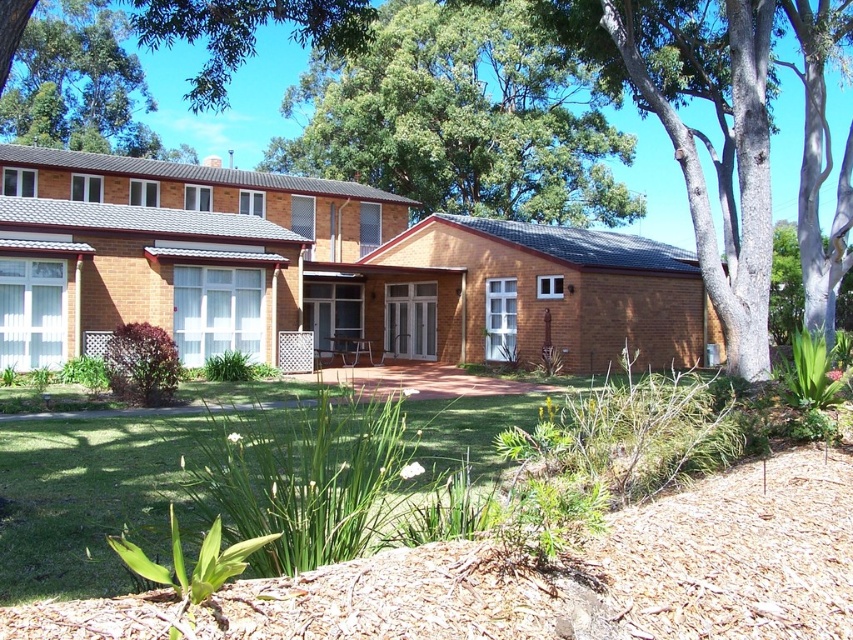
Question: Does brown textured tree at center lie behind green leafy tree at upper left?

Choices:
 (A) yes
 (B) no

Answer: (A)

Question: Is green leafy tree at upper center above green grass at lower left?

Choices:
 (A) yes
 (B) no

Answer: (A)

Question: Can you confirm if green leafy tree at upper center is wider than brown textured tree at center?

Choices:
 (A) yes
 (B) no

Answer: (B)

Question: Among these points, which one is farthest from the camera?

Choices:
 (A) (515, 216)
 (B) (646, 83)
 (C) (175, 492)
 (D) (187, 147)

Answer: (D)

Question: Which of the following is the closest to the observer?

Choices:
 (A) brown textured tree at center
 (B) green grass at lower left
 (C) green leafy tree at upper center

Answer: (B)

Question: Among these objects, which one is farthest from the camera?

Choices:
 (A) green grass at lower left
 (B) brown textured tree at center

Answer: (B)